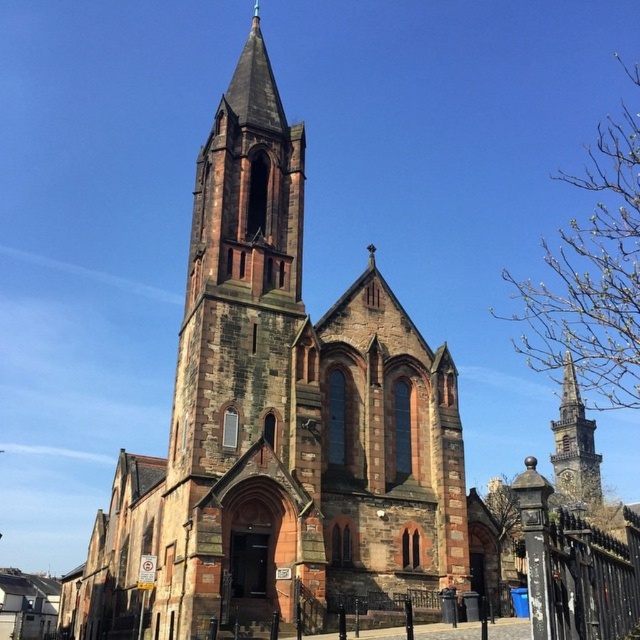
You are a visitor standing in front of the brown stone church at center and the stone spire at right. Which object would appear closer to you in the image?

The brown stone church at center is larger in size than the stone spire at right, so it would appear closer to you since larger objects in a scene typically indicate proximity.

You are standing in front of the brown stone church at center. You want to take a photo of it from a distance where it fits perfectly in your camera frame. The camera you have can capture a maximum distance of 40 meters. Will you be able to take the photo without moving closer?

The brown stone church at center is 40.77 meters away from camera. Since the camera can only capture up to 40 meters, you are slightly too far away to capture the church perfectly in the frame without moving closer.